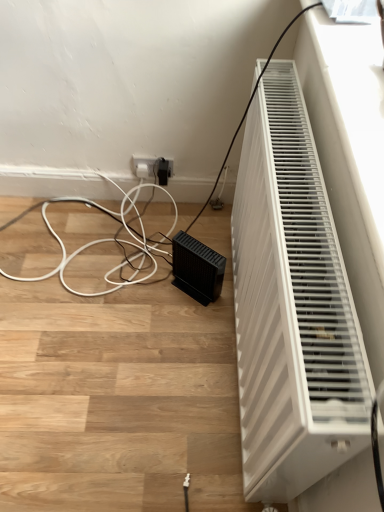
At what (x,y) coordinates should I click in order to perform the action: click on vacant space positioned to the left of white plastic radiator at right. Please return your answer as a coordinate pair (x, y). The width and height of the screenshot is (384, 512). Looking at the image, I should click on (119, 333).